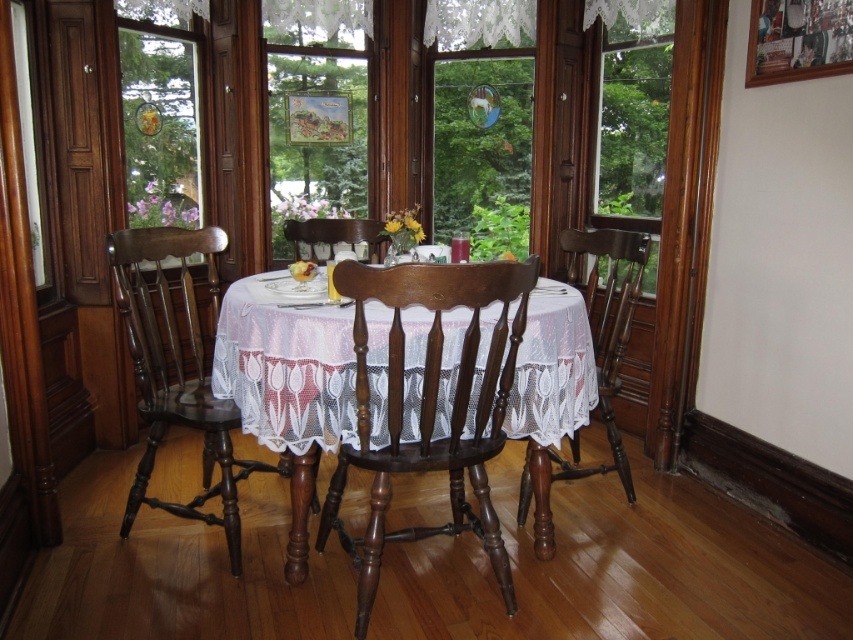
Question: Does clear glass window at upper right appear on the right side of dark wood chair at center?

Choices:
 (A) no
 (B) yes

Answer: (B)

Question: Which object appears closest to the camera in this image?

Choices:
 (A) dark wood chair at left
 (B) polished wood chair at center
 (C) white lace curtain at upper center
 (D) clear glass window at center

Answer: (B)

Question: Observing the image, what is the correct spatial positioning of polished wood chair at center in reference to dark wood chair at center?

Choices:
 (A) below
 (B) above

Answer: (A)

Question: Which of the following is the closest to the observer?

Choices:
 (A) dark wood chair at center
 (B) dark wood chair at left

Answer: (B)

Question: Which of the following is the farthest from the observer?

Choices:
 (A) clear glass window at upper right
 (B) clear glass window at center
 (C) white lace tablecloth at center
 (D) wooden frame at center

Answer: (B)

Question: Can you confirm if polished wood chair at center is positioned below dark wood chair at left?

Choices:
 (A) no
 (B) yes

Answer: (B)